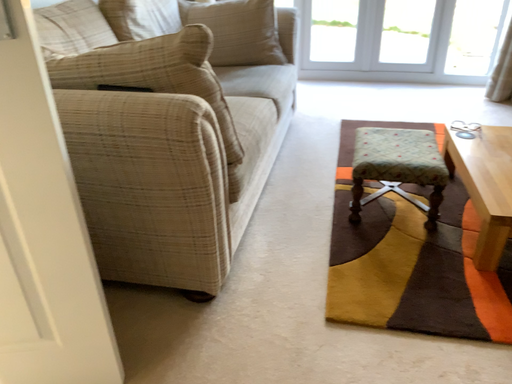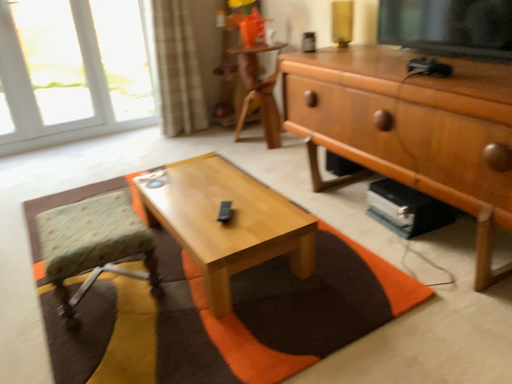
Question: Which way did the camera rotate in the video?

Choices:
 (A) rotated left
 (B) rotated right

Answer: (B)